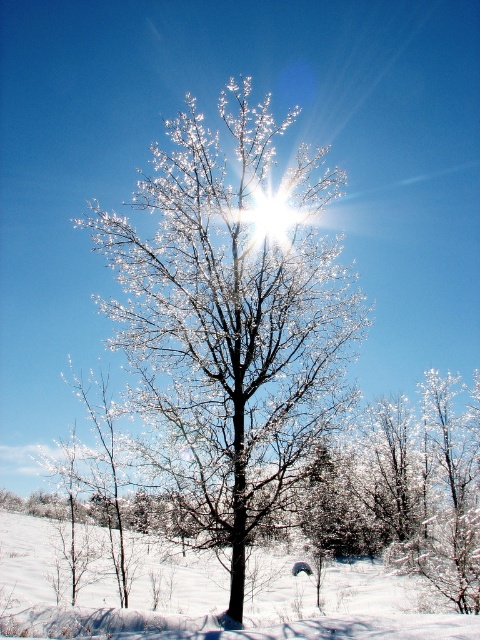
Question: Which point is farther to the camera?

Choices:
 (A) snowy branches at center
 (B) white powdery snow at lower center

Answer: (A)

Question: Among these points, which one is farthest from the camera?

Choices:
 (A) (63, 627)
 (B) (154, 396)

Answer: (B)

Question: Is snowy branches at center in front of white powdery snow at lower center?

Choices:
 (A) yes
 (B) no

Answer: (B)

Question: Can you confirm if snowy branches at center is smaller than white powdery snow at lower center?

Choices:
 (A) yes
 (B) no

Answer: (A)

Question: Does snowy branches at center appear on the left side of white powdery snow at lower center?

Choices:
 (A) no
 (B) yes

Answer: (B)